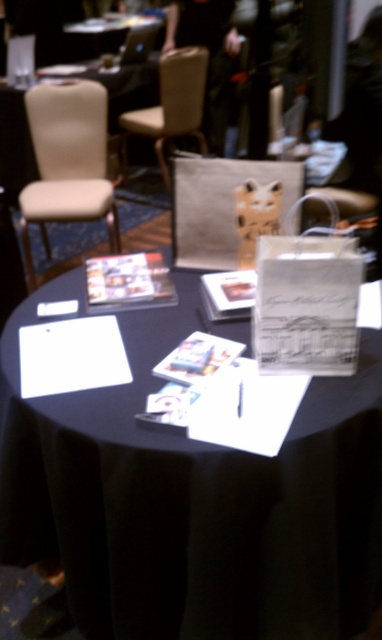
Question: Which point is closer to the camera?

Choices:
 (A) white fabric table at upper left
 (B) beige fabric chair at left
 (C) matte gray paper bag at center
 (D) white paper bag at center

Answer: (D)

Question: Which object is farther from the camera taking this photo?

Choices:
 (A) matte gray paper bag at center
 (B) beige fabric chair at upper center

Answer: (B)

Question: Does black paper at center appear over matte gray paper bag at center?

Choices:
 (A) yes
 (B) no

Answer: (B)

Question: Which object is the closest to the matte gray paper bag at center?

Choices:
 (A) white paper bag at center
 (B) beige fabric chair at left

Answer: (A)

Question: Does black paper at center appear under white fabric table at upper left?

Choices:
 (A) yes
 (B) no

Answer: (A)

Question: Is matte gray paper bag at center bigger than white fabric table at upper left?

Choices:
 (A) yes
 (B) no

Answer: (B)